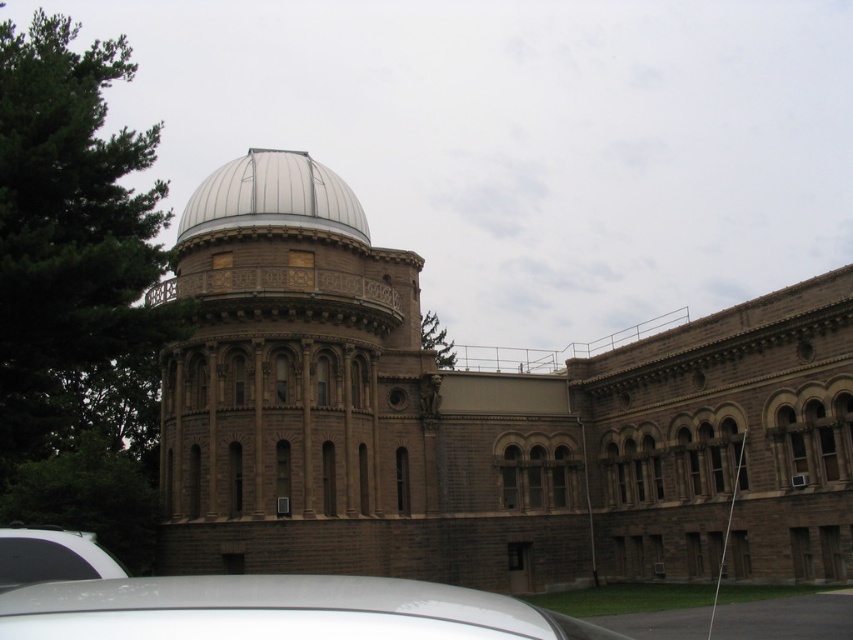
Is point (221, 301) more distant than point (296, 196)?

No, it is in front of (296, 196).

Does brown stone tower at center come behind white matte dome at upper center?

No, brown stone tower at center is closer to the viewer.

What do you see at coordinates (291, 378) in the screenshot? This screenshot has width=853, height=640. I see `brown stone tower at center` at bounding box center [291, 378].

This screenshot has height=640, width=853. In order to click on brown stone tower at center in this screenshot , I will do coord(291,378).

Can you confirm if brown stone tower at center is shorter than white glossy car at lower left?

No, brown stone tower at center is not shorter than white glossy car at lower left.

Is point (241, 211) more distant than point (64, 577)?

Yes.

Locate an element on the screen. brown stone tower at center is located at coordinates (291, 378).

Is point (74, 592) farther from viewer compared to point (88, 570)?

No, (74, 592) is in front of (88, 570).

Between point (277, 598) and point (85, 538), which one is positioned behind?

The point (85, 538) is more distant.

Is point (335, 621) positioned after point (73, 566)?

No.

In order to click on white glossy car at lower center in this screenshot , I will do `click(277, 611)`.